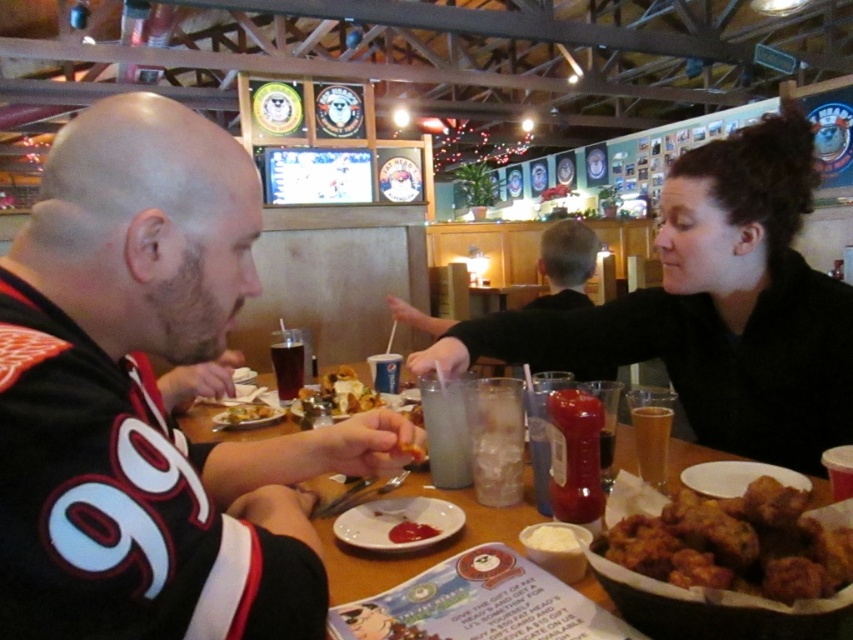
You are a server in this restaurant and need to place a new order of a tall salad on the table. The salad comes in a tall bowl that requires at least 20 cm of vertical space. Looking at the table with the smooth tomato paste at center and the translucent glass cup at table center, which object might interfere with placing the salad due to height constraints?

The translucent glass cup at table center is taller than the smooth tomato paste at center, so it might interfere with placing the salad due to its greater height.

You are standing in the dining area of the sports bar and want to grab a drink from the table where the two people are sitting. The table is located at point (409, 529). If you can reach up to 30 inches, will you be able to reach the drink?

The distance between you and the point (409, 529) is 33.99 inches, which is beyond your 30 inches reach. You cannot reach the drink.

You are a waiter at this sports bar and need to serve a customer. You see the smooth tomato paste at center and the translucent glass cup at table center. Which item is smaller in size?

The smooth tomato paste at center is smaller in size compared to the translucent glass cup at table center.